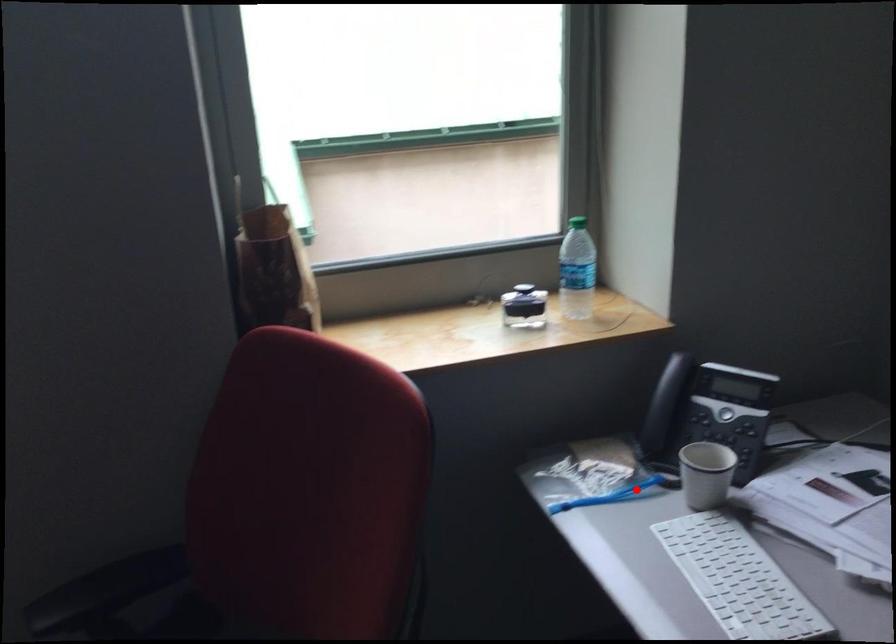
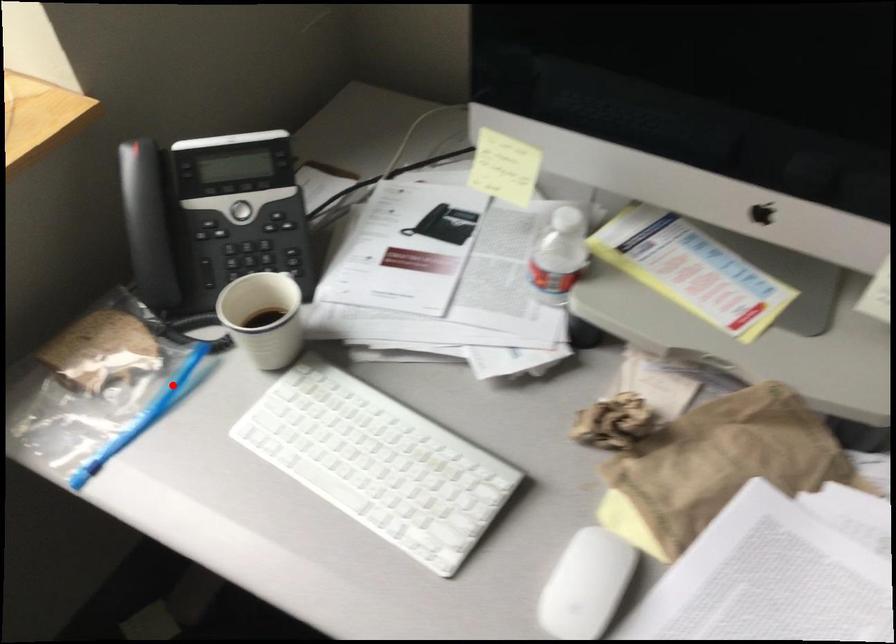
I am providing you with two images of the same scene from different viewpoints. A red point is marked on the first image and another point is marked on the second image. Is the red point in image1 aligned with the point shown in image2?

Yes